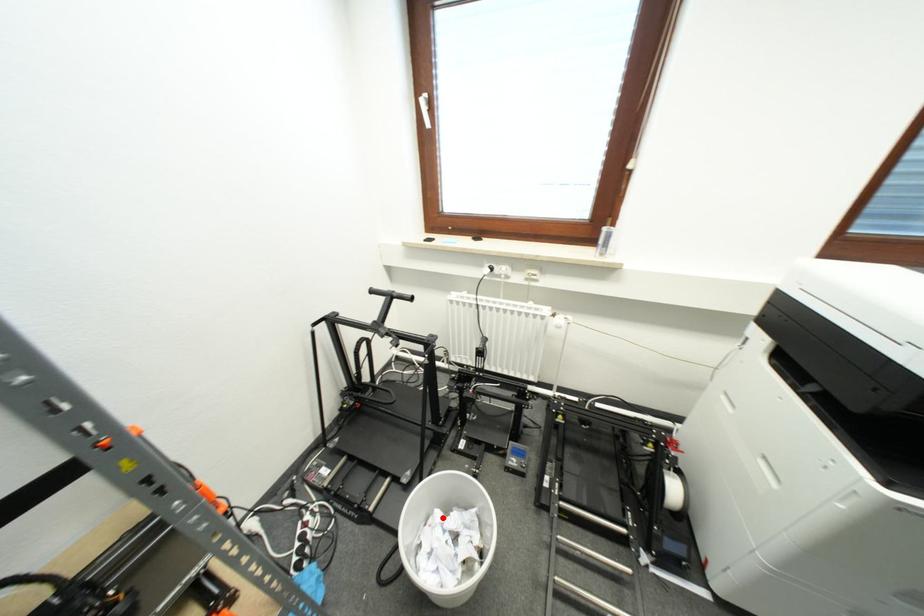
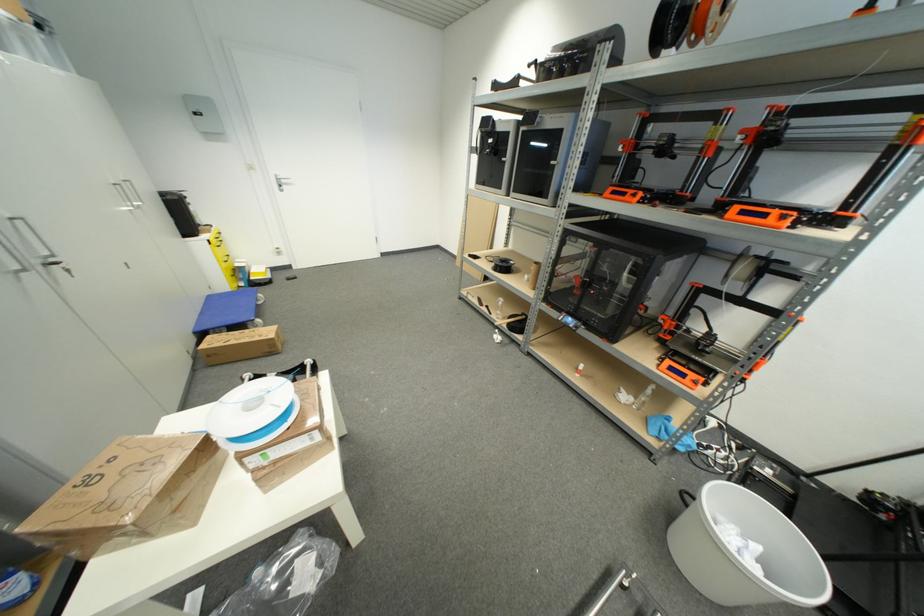
Locate, in the second image, the point that corresponds to the highlighted location in the first image.

(761, 551)